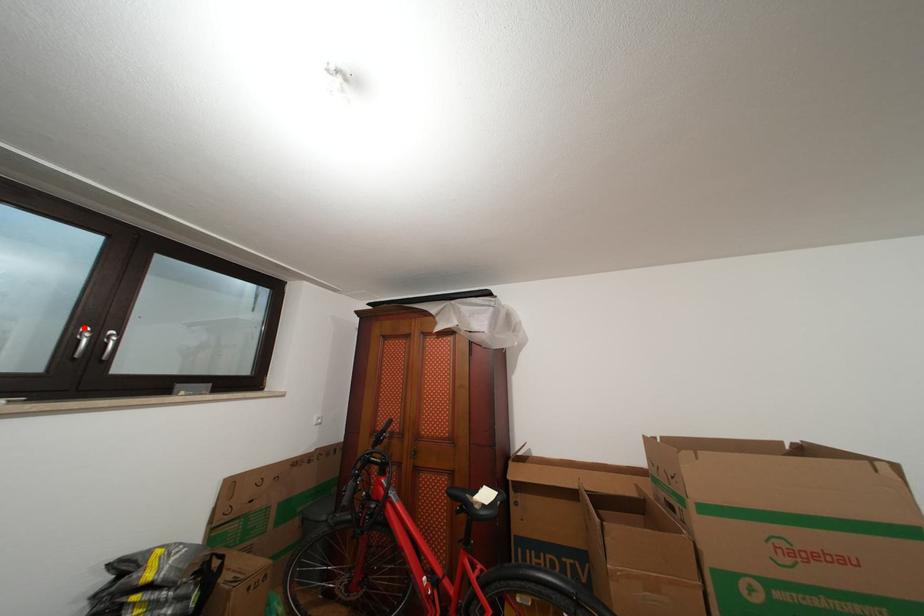
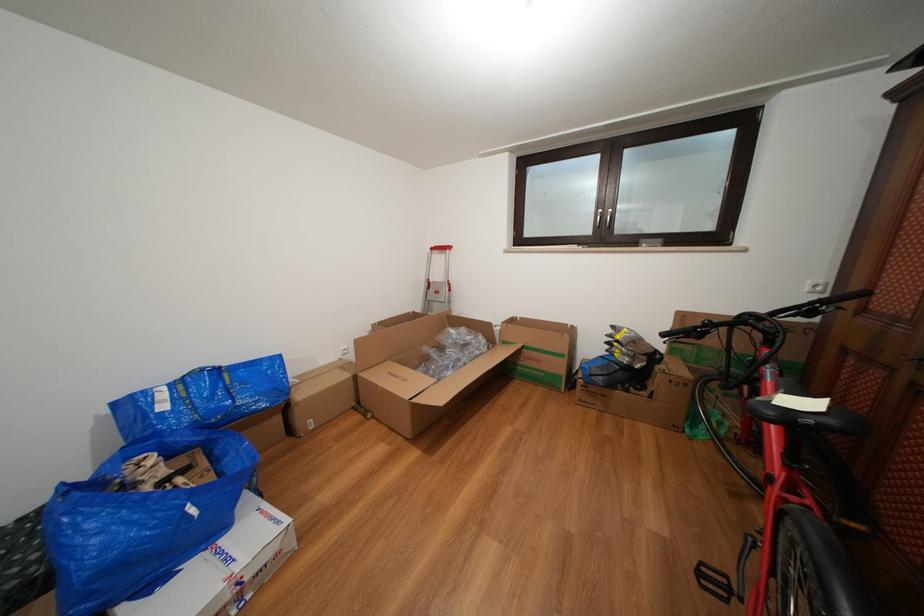
Question: I am providing you with two images of the same scene from different viewpoints. Given a red point in image1, look at the same physical point in image2. Is it:

Choices:
 (A) Closer to the viewpoint
 (B) Farther from the viewpoint

Answer: (A)